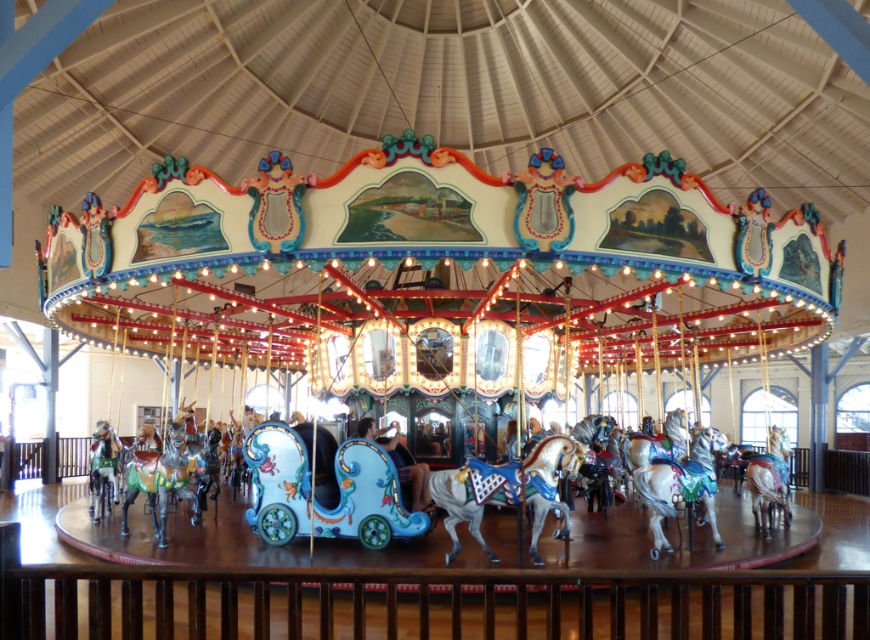
Does shiny silver horse at center appear on the left side of shiny white horse at center?

Indeed, shiny silver horse at center is positioned on the left side of shiny white horse at center.

What do you see at coordinates (506, 490) in the screenshot? I see `shiny silver horse at center` at bounding box center [506, 490].

I want to click on shiny silver horse at center, so click(x=506, y=490).

Consider the image. Between shiny white horse at center and shiny silver horse at lower left, which one is positioned lower?

Positioned lower is shiny silver horse at lower left.

The image size is (870, 640). Find the location of `shiny white horse at center`. shiny white horse at center is located at coordinates (678, 483).

This screenshot has height=640, width=870. I want to click on shiny white horse at center, so click(x=678, y=483).

Between shiny silver horse at center and shiny silver horse at lower left, which one appears on the left side from the viewer's perspective?

From the viewer's perspective, shiny silver horse at lower left appears more on the left side.

Which is in front, point (559, 454) or point (89, 472)?

Point (559, 454) is in front.

Locate an element on the screen. The width and height of the screenshot is (870, 640). shiny silver horse at center is located at coordinates point(506,490).